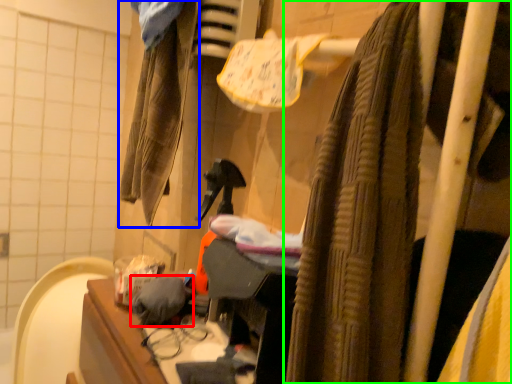
Question: Which object is the closest to the clothing (highlighted by a red box)? Choose among these: clothing (highlighted by a blue box) or curtain (highlighted by a green box).

Choices:
 (A) clothing
 (B) curtain

Answer: (B)